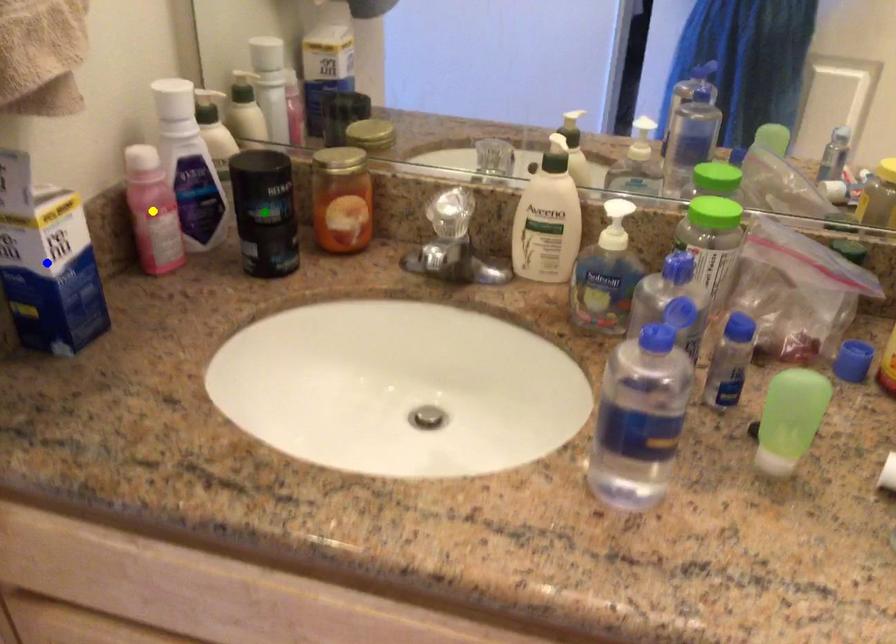
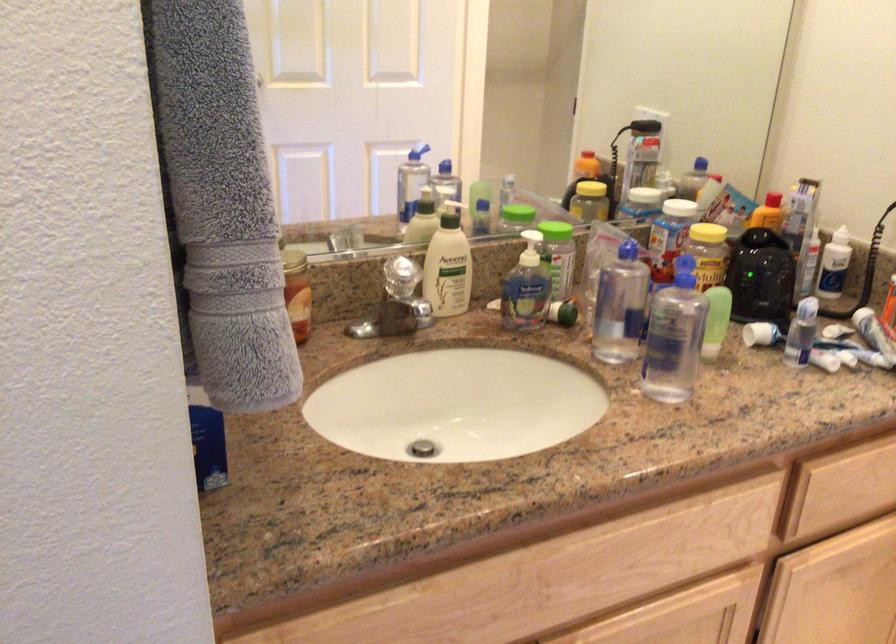
I am providing you with two images of the same scene from different viewpoints. Three points are marked in image1. Which point corresponds to a part or object that is occluded in image2?In image1, three points are marked. Which of them correspond to a part or object that is occluded in image2?Among the three points shown in image1, which one corresponds to a part or object that is no longer visible due to occlusion in image2?

green point, yellow point, blue point